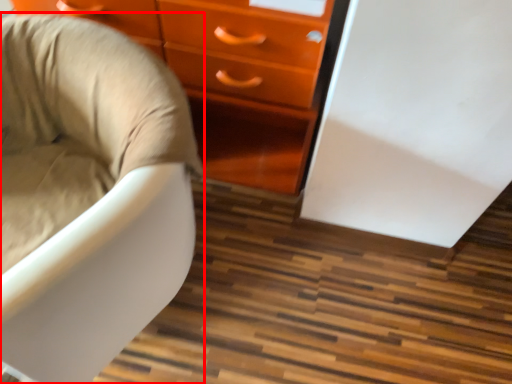
Question: Where is chair (annotated by the red box) located in relation to chest of drawers in the image?

Choices:
 (A) left
 (B) right

Answer: (A)